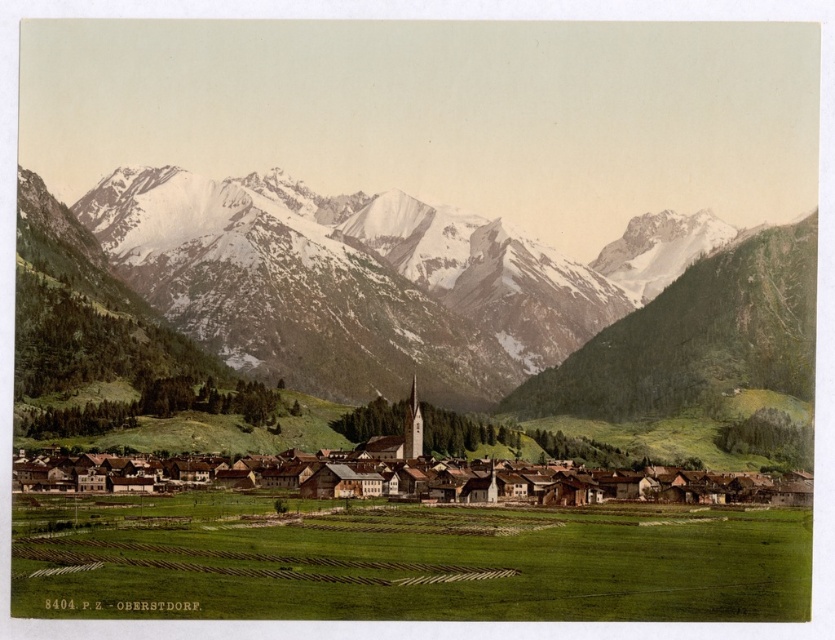
Question: Among these points, which one is nearest to the camera?

Choices:
 (A) pos(611,445)
 (B) pos(208,266)
 (C) pos(365,496)

Answer: (C)

Question: Does snowy granite mountains at upper center have a greater width compared to brown wooden houses at center?

Choices:
 (A) no
 (B) yes

Answer: (B)

Question: Does snowy granite mountains at upper center have a greater width compared to white wooden house at center?

Choices:
 (A) no
 (B) yes

Answer: (B)

Question: Which point is farther to the camera?

Choices:
 (A) (211, 404)
 (B) (704, 360)
 (C) (365, 483)

Answer: (B)

Question: Which of the following is the farthest from the observer?

Choices:
 (A) tap(272, 365)
 (B) tap(438, 428)
 (C) tap(312, 496)

Answer: (A)

Question: Can you confirm if brown wooden houses at center is positioned to the right of white wooden house at center?

Choices:
 (A) yes
 (B) no

Answer: (A)